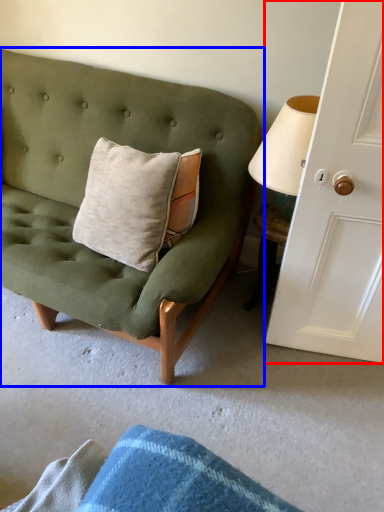
Question: Which object is further to the camera taking this photo, door (highlighted by a red box) or studio couch (highlighted by a blue box)?

Choices:
 (A) door
 (B) studio couch

Answer: (B)